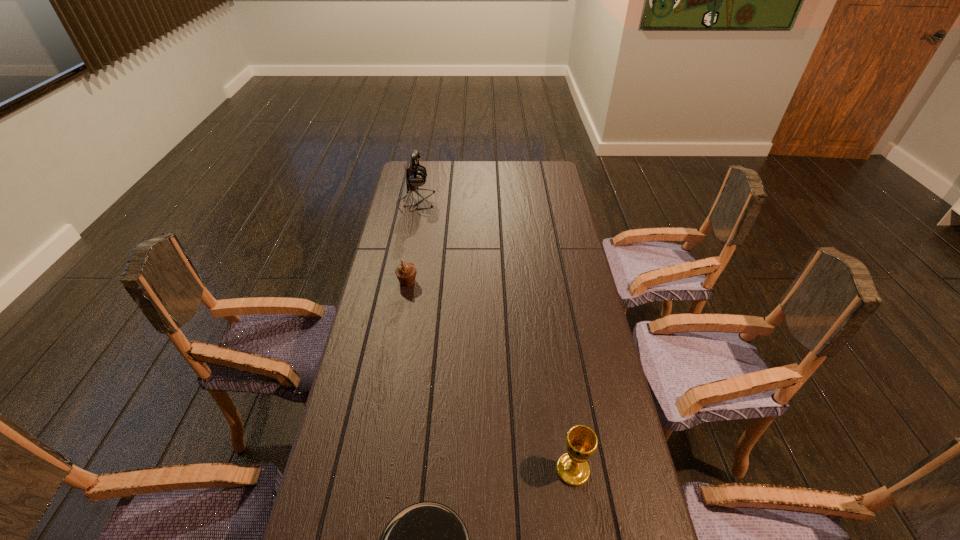
I want to click on the farthest object, so click(416, 176).

Where is `the tallest object`? the tallest object is located at coordinates (416, 176).

Identify the location of the rightmost object. This screenshot has width=960, height=540. (572, 467).

The image size is (960, 540). What are the coordinates of `the third farthest object` in the screenshot? It's located at (572, 467).

This screenshot has width=960, height=540. I want to click on the second farthest object, so click(406, 272).

Locate an element on the screen. The width and height of the screenshot is (960, 540). the second shortest object is located at coordinates (406, 272).

Where is `vacant position located on the right of the farthest object`? This screenshot has height=540, width=960. vacant position located on the right of the farthest object is located at coordinates (489, 201).

What are the coordinates of `vacant space located on the left of the chalice` in the screenshot? It's located at (520, 470).

You are a GUI agent. You are given a task and a screenshot of the screen. Output one action in this format:
    pyautogui.click(x=<x>, y=<y>)
    Task: Click on the vacant space located 0.210m on the right of the second shortest object
    The width and height of the screenshot is (960, 540).
    Given the screenshot: What is the action you would take?
    tap(476, 282)

This screenshot has width=960, height=540. Identify the location of earphone present at the left edge. (416, 176).